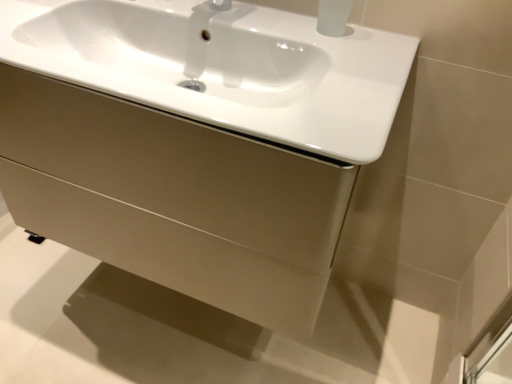
Question: From a real-world perspective, is matte beige drawer at center physically located above or below white glossy sink at center?

Choices:
 (A) above
 (B) below

Answer: (B)

Question: Would you say matte beige drawer at center is inside or outside white glossy sink at center?

Choices:
 (A) inside
 (B) outside

Answer: (B)

Question: In terms of width, does matte beige drawer at center look wider or thinner when compared to white glossy sink at center?

Choices:
 (A) thin
 (B) wide

Answer: (B)

Question: From a real-world perspective, is white glossy sink at center positioned above or below matte beige drawer at center?

Choices:
 (A) above
 (B) below

Answer: (A)

Question: Based on their sizes in the image, would you say white glossy sink at center is bigger or smaller than matte beige drawer at center?

Choices:
 (A) big
 (B) small

Answer: (B)

Question: Considering their positions, is white glossy sink at center located in front of or behind matte beige drawer at center?

Choices:
 (A) behind
 (B) front

Answer: (B)

Question: Is point pos(369,139) closer or farther from the camera than point pos(128,188)?

Choices:
 (A) farther
 (B) closer

Answer: (B)